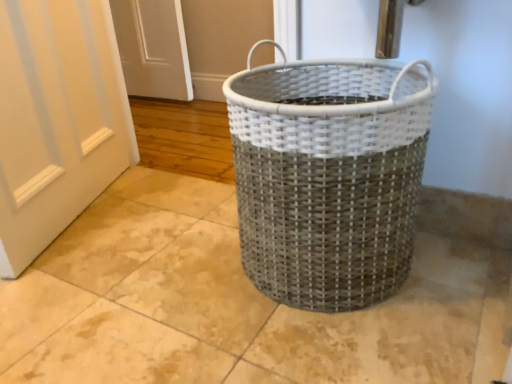
Question: Is point (244, 208) closer or farther from the camera than point (112, 36)?

Choices:
 (A) closer
 (B) farther

Answer: (A)

Question: Considering the positions of white woven basket at center and white painted wood door at left in the image, is white woven basket at center taller or shorter than white painted wood door at left?

Choices:
 (A) short
 (B) tall

Answer: (A)

Question: Looking at their shapes, would you say white woven basket at center is wider or thinner than white painted wood door at left?

Choices:
 (A) wide
 (B) thin

Answer: (A)

Question: From the image's perspective, is white painted wood door at left above or below white woven basket at center?

Choices:
 (A) above
 (B) below

Answer: (A)

Question: Considering the positions of white painted wood door at left and white woven basket at center in the image, is white painted wood door at left bigger or smaller than white woven basket at center?

Choices:
 (A) big
 (B) small

Answer: (B)

Question: Is white painted wood door at left in front of or behind white woven basket at center in the image?

Choices:
 (A) behind
 (B) front

Answer: (A)

Question: Considering the positions of white painted wood door at left and white woven basket at center in the image, is white painted wood door at left taller or shorter than white woven basket at center?

Choices:
 (A) short
 (B) tall

Answer: (B)